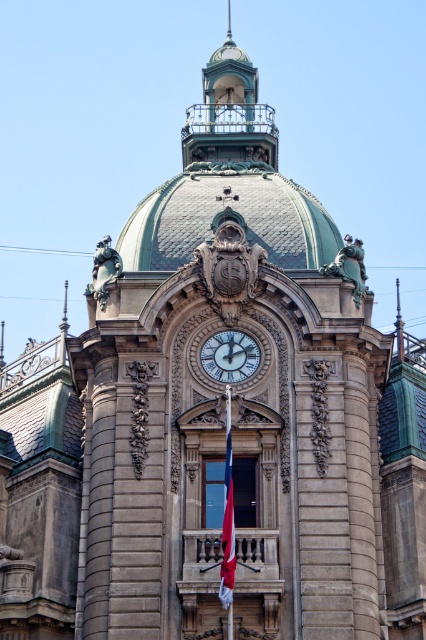
Question: Can you confirm if white glossy clock at center is smaller than red fabric flag at center?

Choices:
 (A) yes
 (B) no

Answer: (A)

Question: Which point is closer to the camera?

Choices:
 (A) red fabric flag at center
 (B) white glossy clock at center

Answer: (A)

Question: Which object is farther from the camera taking this photo?

Choices:
 (A) white glossy clock at center
 (B) red fabric flag at center

Answer: (A)

Question: Considering the relative positions of white glossy clock at center and red fabric flag at center in the image provided, where is white glossy clock at center located with respect to red fabric flag at center?

Choices:
 (A) left
 (B) right

Answer: (B)

Question: Is white glossy clock at center to the right of red fabric flag at center from the viewer's perspective?

Choices:
 (A) no
 (B) yes

Answer: (B)